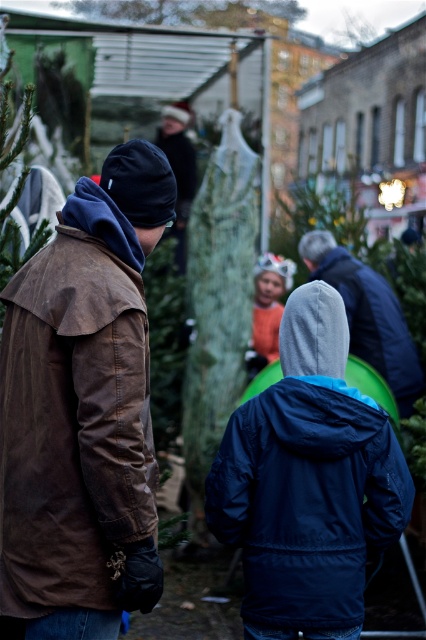
You are a photographer trying to capture a photo of the brown waxed leather jacket at left and the green matte christmas tree at upper center in the same frame. Based on their sizes, which object will appear larger in the photo?

The green matte christmas tree at upper center will appear larger in the photo because it is larger than the brown waxed leather jacket at left.

You are at a Christmas tree market and want to find the orange fuzzy hat at center. Which direction should you look relative to the green matte christmas tree at upper center?

The orange fuzzy hat at center is located below the green matte christmas tree at upper center, so you should look downward from the green matte christmas tree at upper center to find it.

You are standing in the Christmas tree market and want to find the green textured christmas tree at center. Based on the coordinates provided, can you determine its exact position relative to the other elements in the scene?

The green textured christmas tree at center is located at coordinates point (218, 301), which places it centrally in the scene as described.